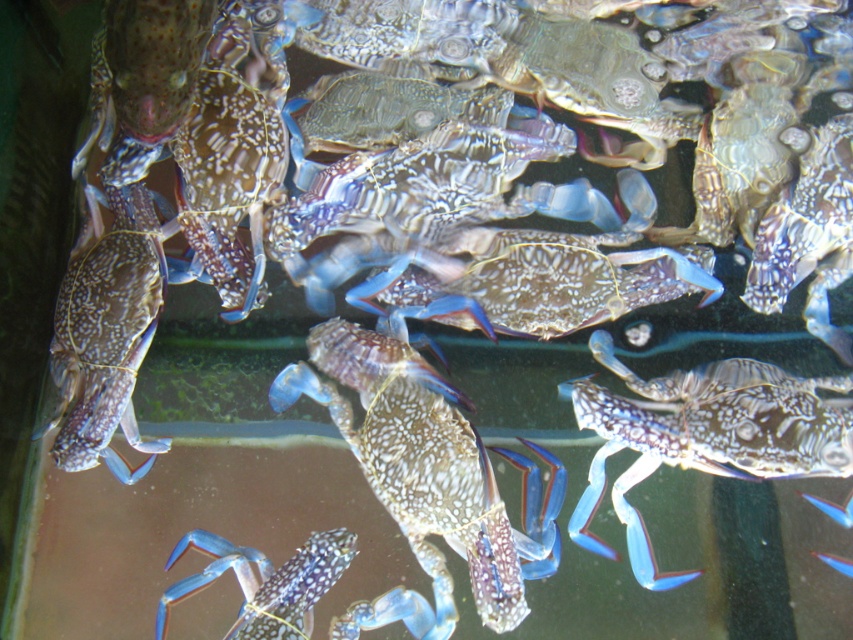
You are a seafood vendor who needs to determine which crab is bigger to price them appropriately. You have a blue speckled crab at center and a shiny blue crab at bottom left in front of you. Which one should you price higher based on size?

The blue speckled crab at center has a larger size compared to the shiny blue crab at bottom left, so you should price the blue speckled crab at center higher based on its size.

You are a seafood vendor who needs to place a new crab into the tank. The new crab is 3 inches wide. There is a space between the speckled shell crab at center and the blue speckled crab at center. Can the new crab fit in that space?

The space between the speckled shell crab at center and the blue speckled crab at center is 6.70 inches. Since the new crab is 3 inches wide, it can fit in the space as it is wider than the crab.

You are a marine biologist observing crabs in a tank. You need to locate the speckled shell crab at center. What are its coordinates?

The speckled shell crab at center is located at coordinates point (418, 461).